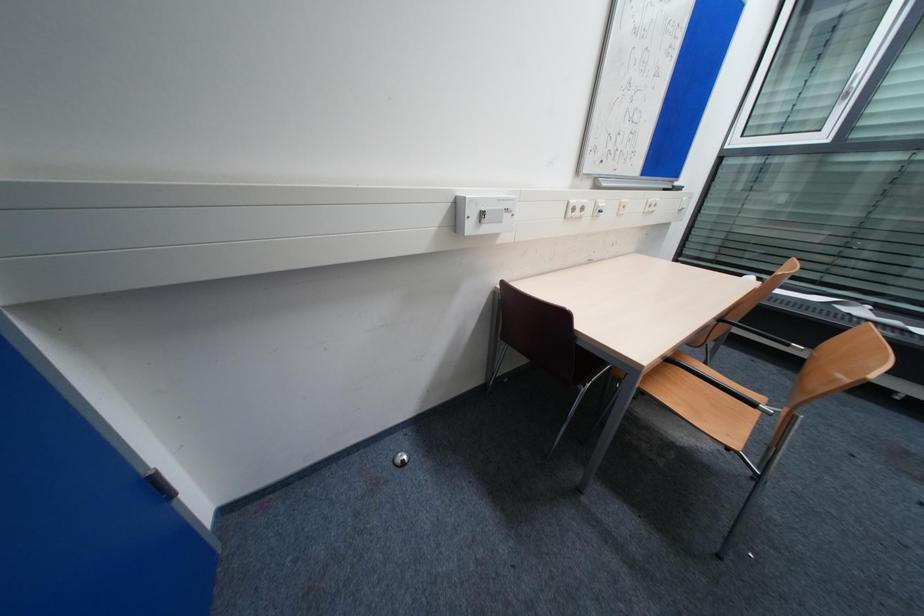
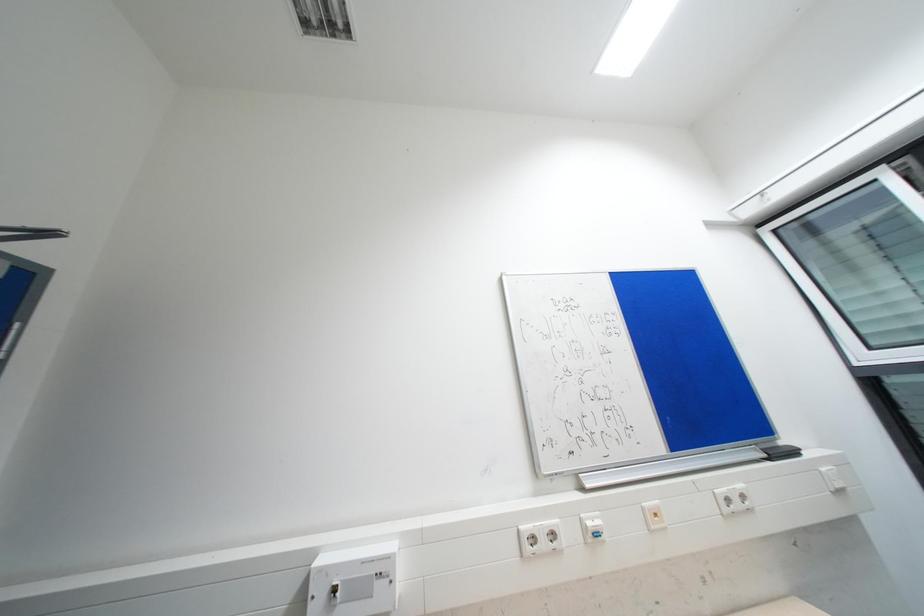
Based on the continuous images, in which direction is the camera rotating?

The rotation direction of the camera is left-up.